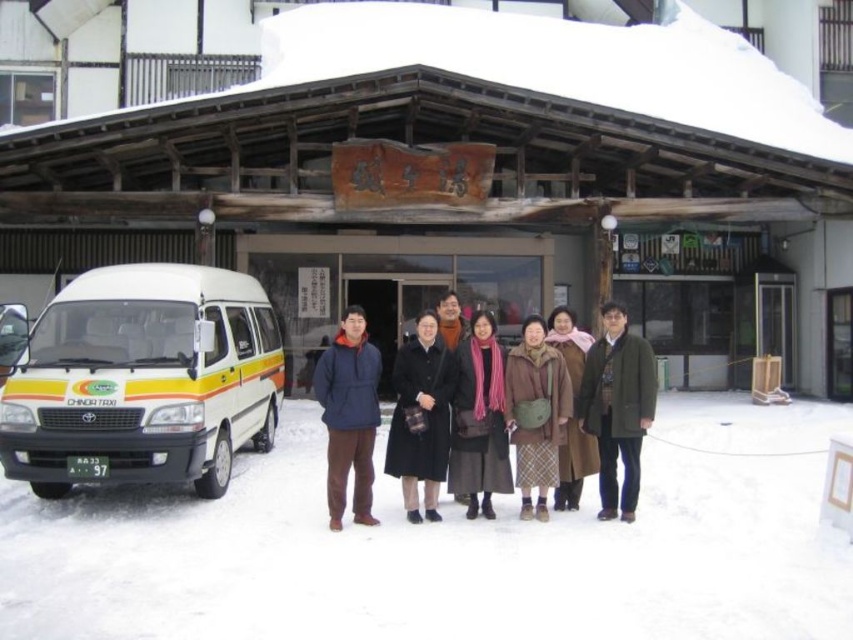
Question: Where is green wool coat at center located in relation to dark blue jacket at center in the image?

Choices:
 (A) above
 (B) below

Answer: (B)

Question: Which point appears closest to the camera in this image?

Choices:
 (A) (143, 474)
 (B) (537, 116)
 (C) (560, 394)
 (D) (354, 397)

Answer: (D)

Question: Which object is farther from the camera taking this photo?

Choices:
 (A) dark brown wool coat at center
 (B) green wool coat at center

Answer: (A)

Question: Is white glossy van at left thinner than dark blue jacket at center?

Choices:
 (A) yes
 (B) no

Answer: (B)

Question: Does wooden hut at center have a smaller size compared to dark blue jacket at center?

Choices:
 (A) no
 (B) yes

Answer: (A)

Question: Which of the following is the farthest from the observer?

Choices:
 (A) (582, 340)
 (B) (502, 416)

Answer: (A)